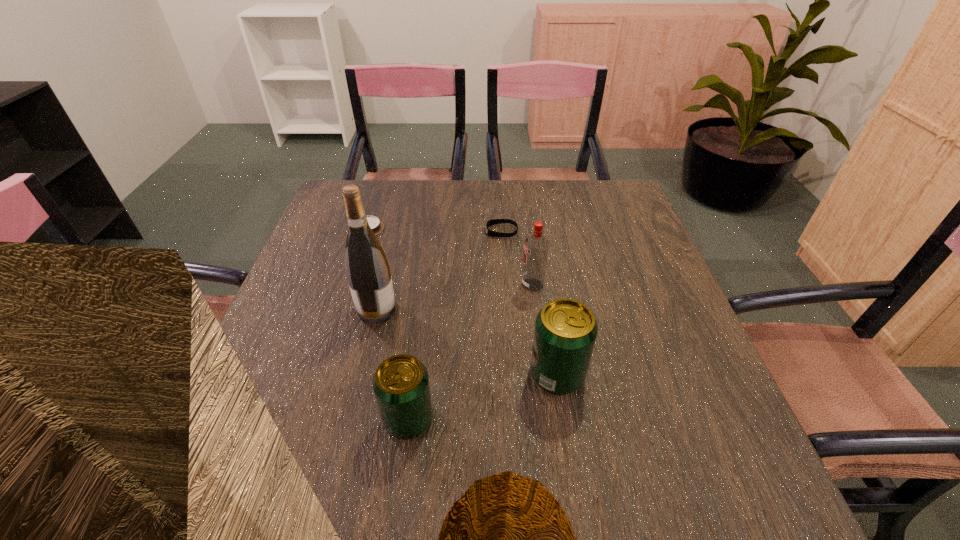
Where is `free space located on the front of the chocolate cake`? This screenshot has width=960, height=540. free space located on the front of the chocolate cake is located at coordinates (334, 335).

Find the location of `vacant space positioned 0.380m on the label of the wine bottle`. vacant space positioned 0.380m on the label of the wine bottle is located at coordinates (563, 310).

Locate an element on the screen. This screenshot has height=540, width=960. vacant area situated 0.140m on the front label of the vodka is located at coordinates (463, 285).

This screenshot has height=540, width=960. Find the location of `free space located 0.360m on the front label of the vodka`. free space located 0.360m on the front label of the vodka is located at coordinates (372, 285).

Locate an element on the screen. The width and height of the screenshot is (960, 540). vacant space positioned on the front label of the vodka is located at coordinates (484, 285).

Image resolution: width=960 pixels, height=540 pixels. I want to click on vacant space positioned 0.370m on the display of the wristband, so click(353, 231).

Locate an element on the screen. This screenshot has height=540, width=960. blank space located on the display of the wristband is located at coordinates (443, 231).

Find the location of a particular element. vacant space located on the display of the wristband is located at coordinates pyautogui.click(x=464, y=231).

Locate an element on the screen. This screenshot has width=960, height=540. object that is at the far edge is located at coordinates (376, 225).

Locate an element on the screen. This screenshot has width=960, height=540. object that is at the near edge is located at coordinates (401, 385).